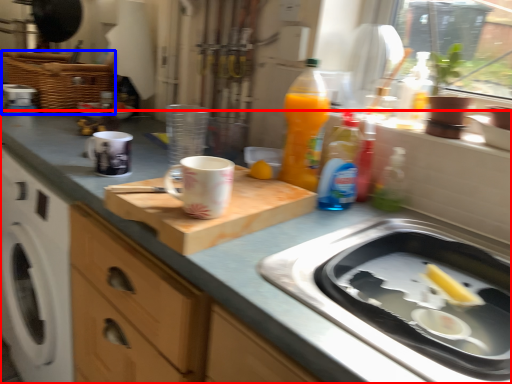
Question: Which point is further to the camera, countertop (highlighted by a red box) or basket (highlighted by a blue box)?

Choices:
 (A) countertop
 (B) basket

Answer: (B)